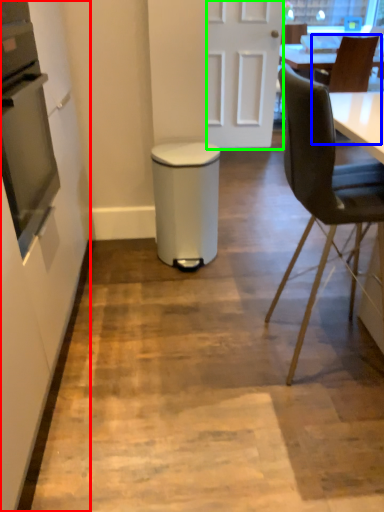
Question: Considering the real-world distances, which object is farthest from side (highlighted by a red box)? chair (highlighted by a blue box) or door (highlighted by a green box)?

Choices:
 (A) chair
 (B) door

Answer: (A)